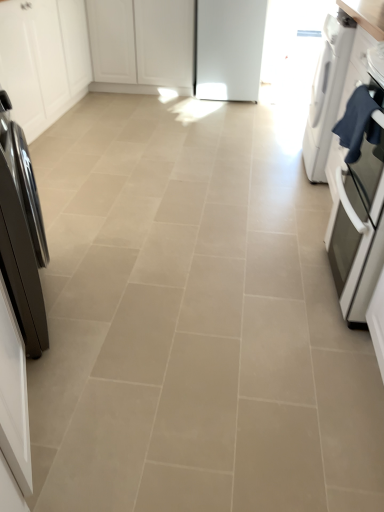
Find the location of a particular element. This screenshot has width=384, height=512. free space between white matte cabinet at center, the second cabinetry viewed from the left, and matte stainless steel oven at right is located at coordinates (233, 161).